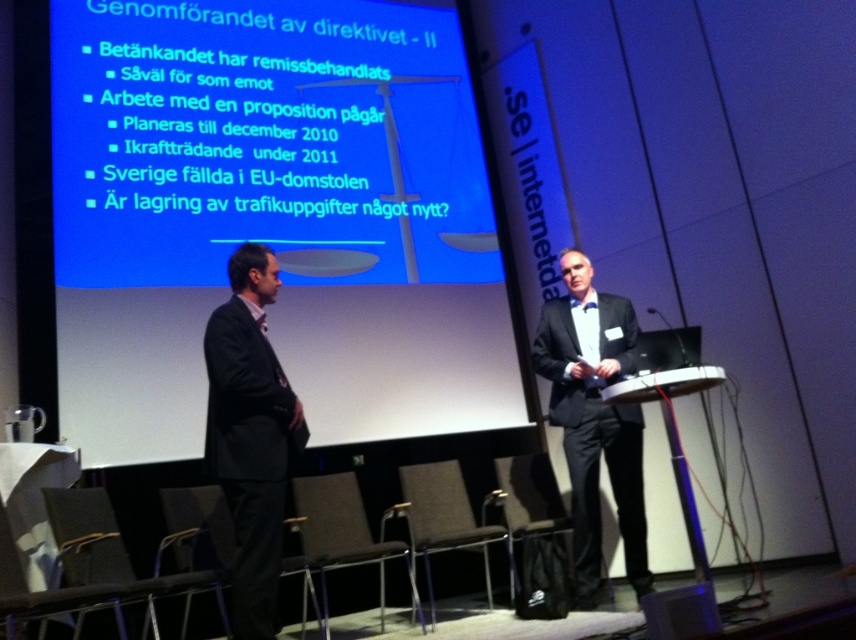
Question: Which object is closer to the camera taking this photo?

Choices:
 (A) black suit at center
 (B) blue plastic speaker at lower right
 (C) black suit at left
 (D) blue matte projection screen at upper center

Answer: (B)

Question: Can you confirm if blue matte projection screen at upper center is positioned below black suit at left?

Choices:
 (A) no
 (B) yes

Answer: (A)

Question: Which point is closer to the camera taking this photo?

Choices:
 (A) (651, 598)
 (B) (571, 433)
 (C) (438, 376)
 (D) (236, 412)

Answer: (A)

Question: Which is farther from the blue plastic speaker at lower right?

Choices:
 (A) blue matte projection screen at upper center
 (B) black suit at center
 (C) black suit at left

Answer: (A)

Question: In this image, where is blue matte projection screen at upper center located relative to black suit at center?

Choices:
 (A) right
 (B) left

Answer: (B)

Question: Is black suit at center to the right of blue plastic speaker at lower right from the viewer's perspective?

Choices:
 (A) yes
 (B) no

Answer: (A)